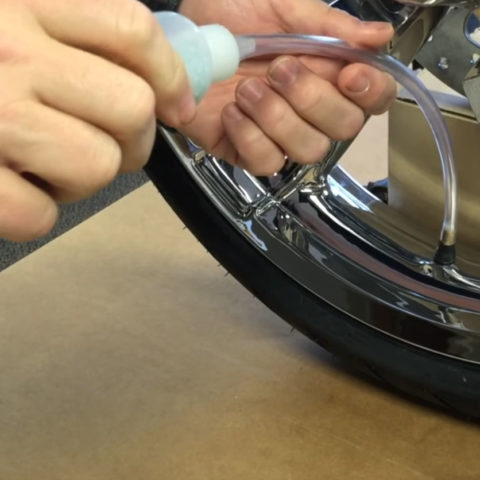
The width and height of the screenshot is (480, 480). In order to click on brown floor in this screenshot , I will do `click(288, 424)`.